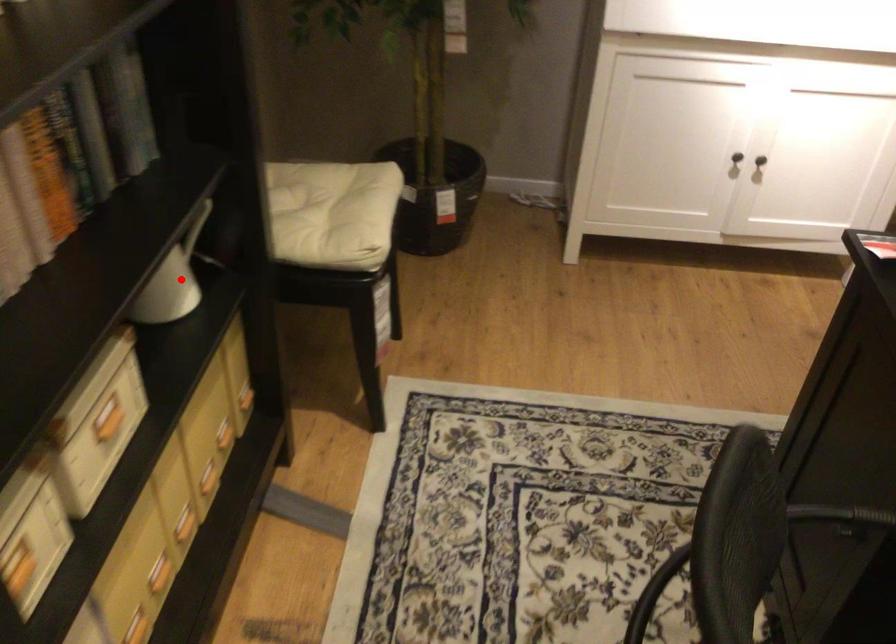
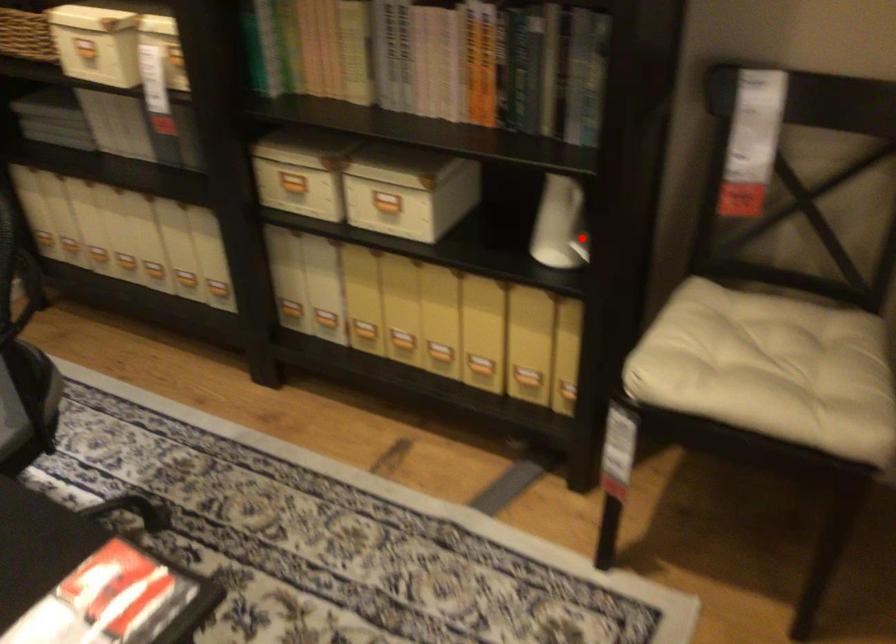
I am providing you with two images of the same scene from different viewpoints. A red point is marked on the first image and another point is marked on the second image. Are the points marked in image1 and image2 representing the same 3D position?

Yes